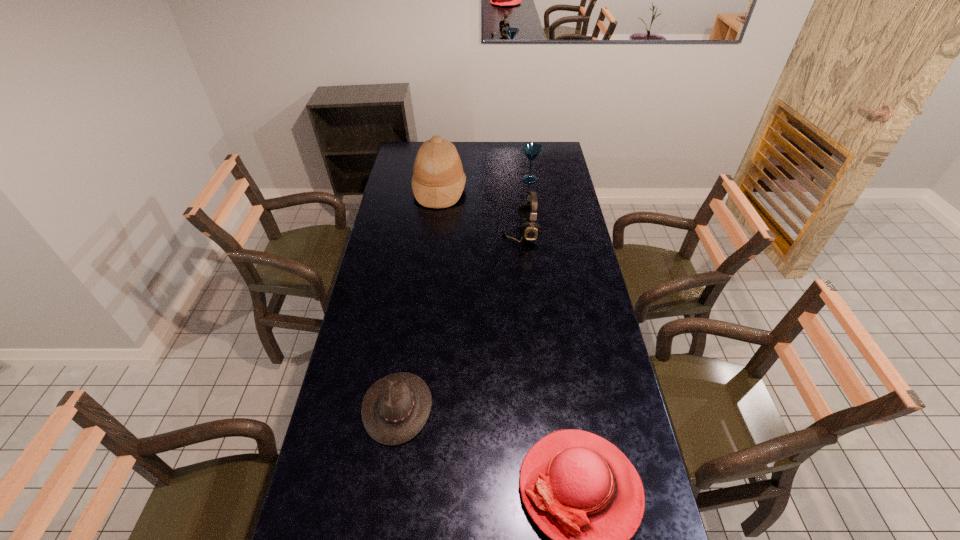
Locate an element on the screen. This screenshot has width=960, height=540. vacant space situated 0.150m on the front-facing side of the shortest hat is located at coordinates (481, 407).

I want to click on object that is at the right edge, so click(532, 150).

The height and width of the screenshot is (540, 960). I want to click on free spot at the left edge of the desktop, so click(363, 309).

Find the location of a particular element. The image size is (960, 540). free region at the right edge is located at coordinates (556, 180).

At what (x,y) coordinates should I click in order to perform the action: click on free spot between the shortest hat and the headset. Please return your answer as a coordinate pair (x, y). Looking at the image, I should click on (459, 320).

Image resolution: width=960 pixels, height=540 pixels. In order to click on free space that is in between the third farthest object and the shortest object in this screenshot , I will do `click(459, 320)`.

What are the coordinates of `vacant space that's between the tallest hat and the headset` in the screenshot? It's located at (480, 211).

Locate an element on the screen. The image size is (960, 540). blank region between the tallest hat and the headset is located at coordinates (480, 211).

The image size is (960, 540). I want to click on object identified as the third closest to the rightmost hat, so click(x=438, y=180).

Locate which object is the second closest to the second shortest object. Please provide its 2D coordinates. Your answer should be formatted as a tuple, i.e. [(x, y)], where the tuple contains the x and y coordinates of a point satisfying the conditions above.

[(528, 212)]